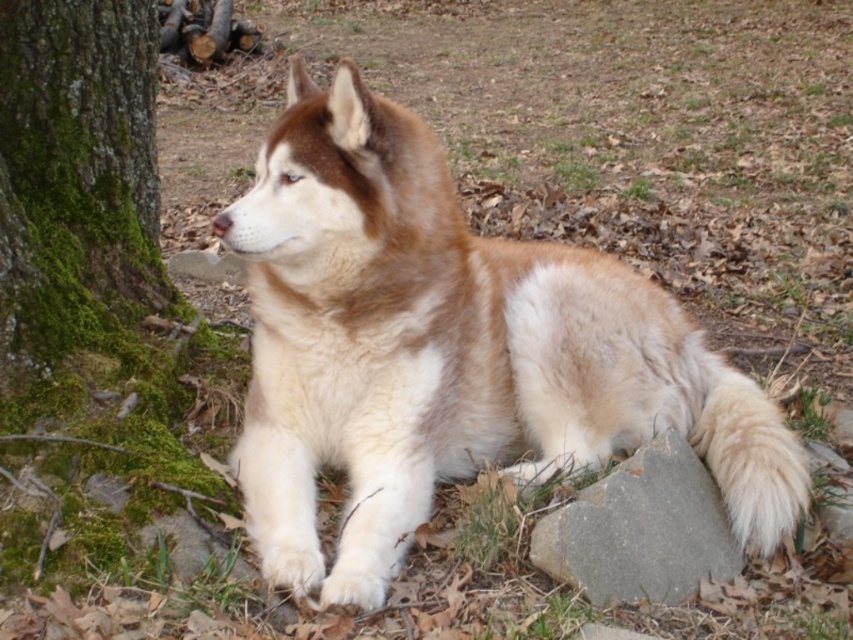
Question: Among these objects, which one is farthest from the camera?

Choices:
 (A) gray smooth stone at lower right
 (B) fuzzy fur dog at center

Answer: (A)

Question: Which object appears farthest from the camera in this image?

Choices:
 (A) fuzzy fur dog at center
 (B) gray smooth stone at lower right

Answer: (B)

Question: Which of the following is the closest to the observer?

Choices:
 (A) fuzzy fur dog at center
 (B) gray smooth stone at lower right

Answer: (A)

Question: Does fuzzy fur dog at center have a smaller size compared to gray smooth stone at lower right?

Choices:
 (A) no
 (B) yes

Answer: (A)

Question: Does fuzzy fur dog at center appear on the left side of gray smooth stone at lower right?

Choices:
 (A) yes
 (B) no

Answer: (A)

Question: Can you confirm if fuzzy fur dog at center is wider than gray smooth stone at lower right?

Choices:
 (A) no
 (B) yes

Answer: (B)